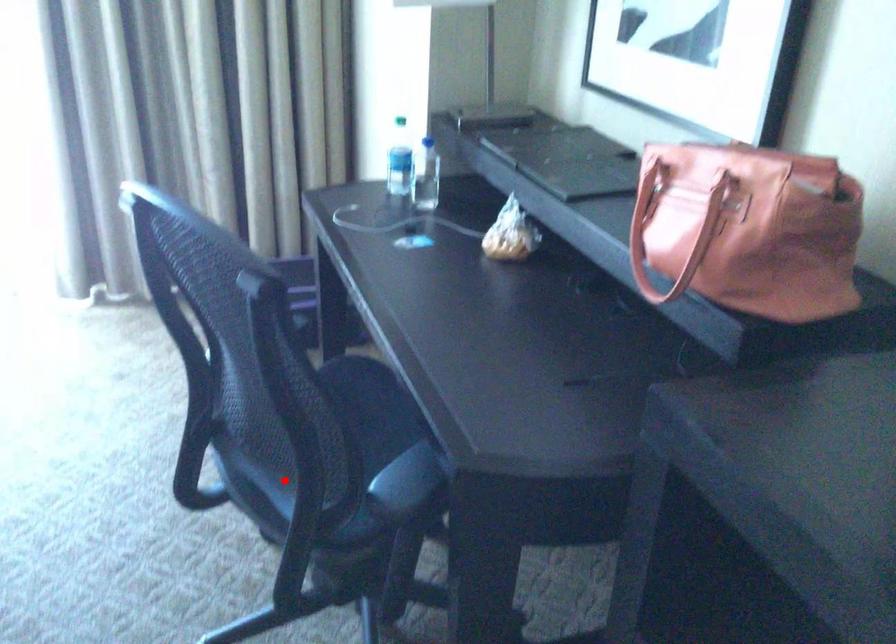
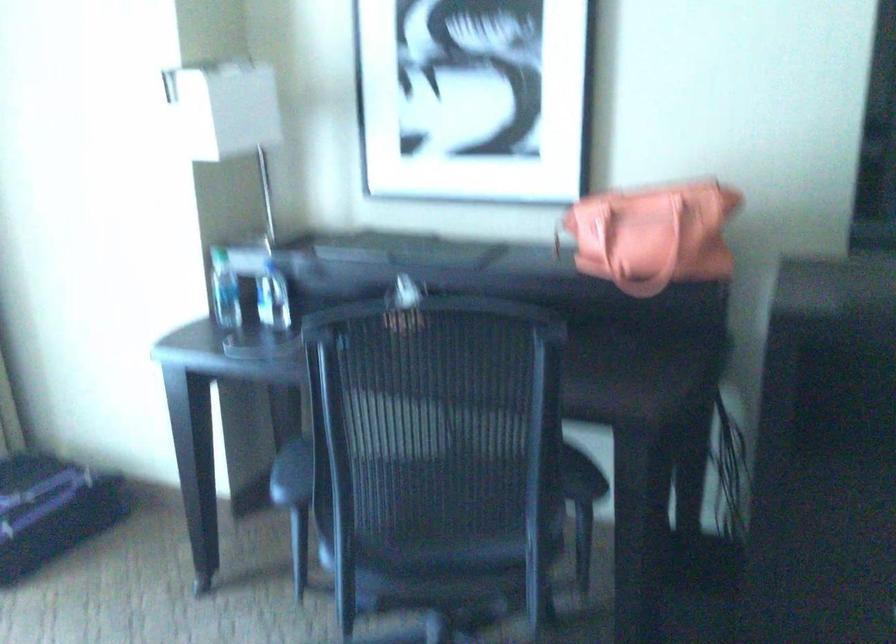
Locate, in the second image, the point that corresponds to the highlighted location in the first image.

(458, 544)